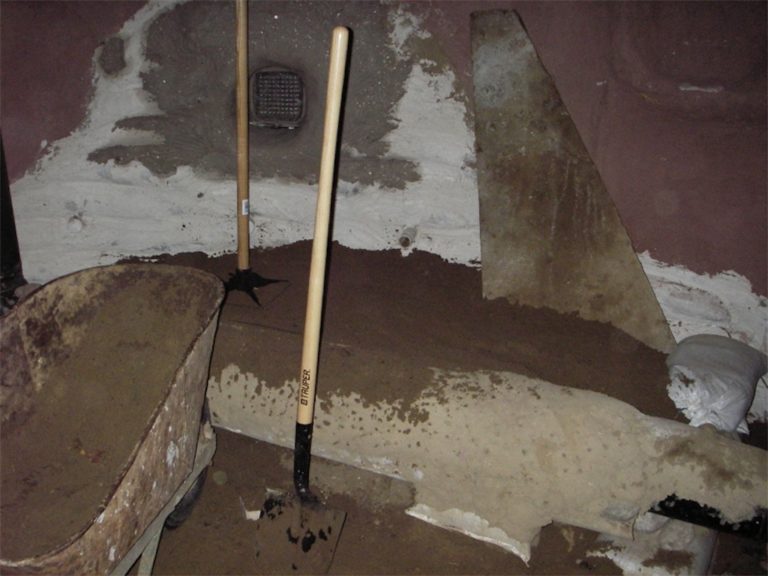
The image size is (768, 576). In order to click on bottom of handle in this screenshot , I will do `click(302, 426)`, `click(243, 271)`.